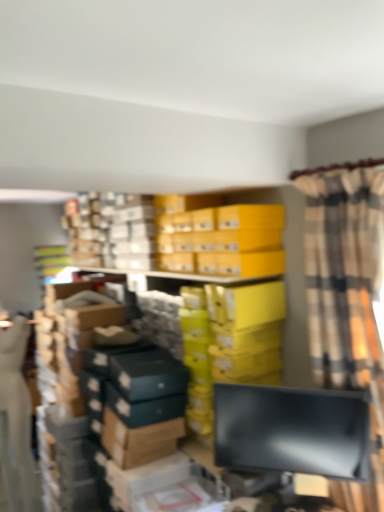
Question: From the image's perspective, is matte black monitor at lower right under yellow cardboard boxes at upper center?

Choices:
 (A) no
 (B) yes

Answer: (B)

Question: From the image's perspective, is matte black monitor at lower right above yellow cardboard boxes at upper center?

Choices:
 (A) no
 (B) yes

Answer: (A)

Question: Does matte black monitor at lower right have a lesser height compared to yellow cardboard boxes at upper center?

Choices:
 (A) yes
 (B) no

Answer: (B)

Question: Considering the relative sizes of matte black monitor at lower right and yellow cardboard boxes at upper center in the image provided, is matte black monitor at lower right thinner than yellow cardboard boxes at upper center?

Choices:
 (A) no
 (B) yes

Answer: (B)

Question: From a real-world perspective, is matte black monitor at lower right physically below yellow cardboard boxes at upper center?

Choices:
 (A) no
 (B) yes

Answer: (B)

Question: Does matte black monitor at lower right turn towards yellow cardboard boxes at upper center?

Choices:
 (A) yes
 (B) no

Answer: (B)

Question: Does plaid fabric curtain at right have a larger size compared to yellow cardboard boxes at upper center?

Choices:
 (A) yes
 (B) no

Answer: (A)

Question: Does plaid fabric curtain at right appear on the left side of yellow cardboard boxes at upper center?

Choices:
 (A) yes
 (B) no

Answer: (B)

Question: Does plaid fabric curtain at right have a greater height compared to yellow cardboard boxes at upper center?

Choices:
 (A) yes
 (B) no

Answer: (A)

Question: Can you confirm if plaid fabric curtain at right is wider than yellow cardboard boxes at upper center?

Choices:
 (A) yes
 (B) no

Answer: (B)

Question: Does plaid fabric curtain at right have a lesser height compared to yellow cardboard boxes at upper center?

Choices:
 (A) no
 (B) yes

Answer: (A)

Question: From the image's perspective, is plaid fabric curtain at right on yellow cardboard boxes at upper center?

Choices:
 (A) no
 (B) yes

Answer: (A)

Question: Is matte black monitor at lower right next to plaid fabric curtain at right and touching it?

Choices:
 (A) yes
 (B) no

Answer: (B)